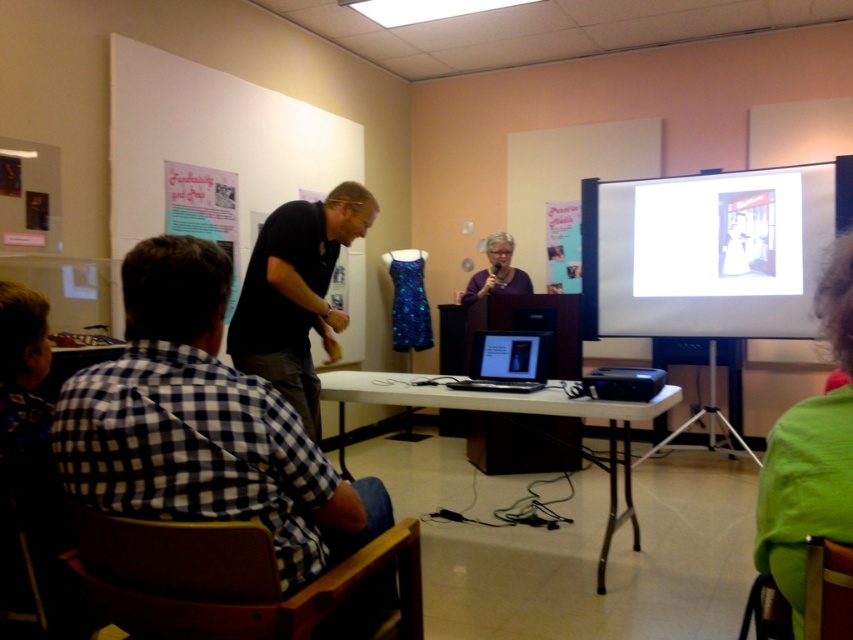
Question: Which point is closer to the camera?

Choices:
 (A) (585, 378)
 (B) (440, 401)
 (C) (798, 216)

Answer: (A)

Question: Where is white matte projection screen at upper right located in relation to purple fabric at center in the image?

Choices:
 (A) above
 (B) below

Answer: (A)

Question: Among these objects, which one is farthest from the camera?

Choices:
 (A) purple fabric at center
 (B) black matte shirt at center

Answer: (A)

Question: Does white matte projection screen at upper right have a larger size compared to black matte shirt at center?

Choices:
 (A) yes
 (B) no

Answer: (A)

Question: Which point is farther to the camera?

Choices:
 (A) black glossy laptop at center
 (B) black plastic projector at lower center
 (C) white glossy table at center
 (D) purple fabric at center

Answer: (D)

Question: Where is checkered fabric shirt at left located in relation to black glossy laptop at center in the image?

Choices:
 (A) above
 (B) below

Answer: (B)